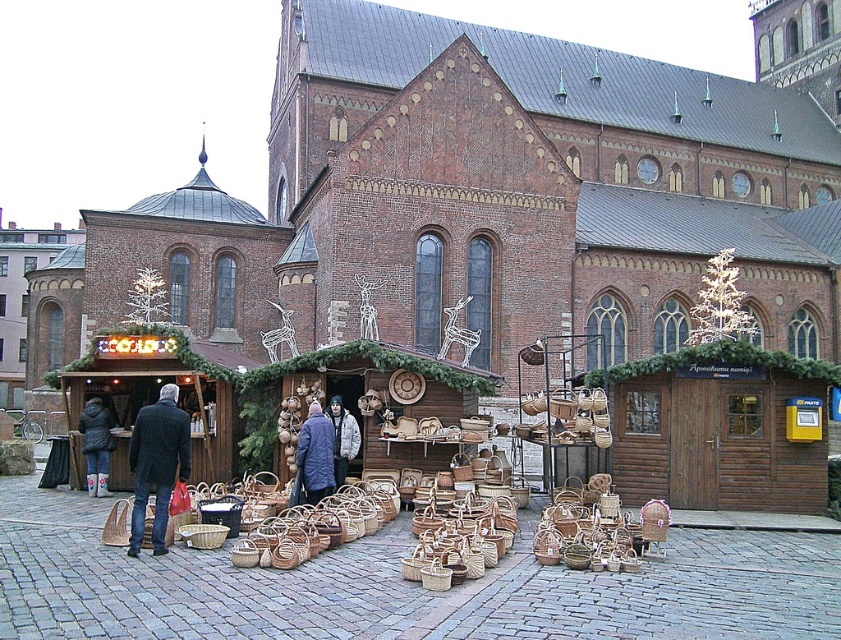
Question: Which point is closer to the camera?

Choices:
 (A) dark blue coat at center
 (B) white rubber boots at lower left
 (C) white puffy jacket at center

Answer: (A)

Question: Does white rubber boots at lower left appear on the right side of white puffy jacket at center?

Choices:
 (A) no
 (B) yes

Answer: (A)

Question: Is blue quilted coat at center to the left of white rubber boots at lower left from the viewer's perspective?

Choices:
 (A) yes
 (B) no

Answer: (B)

Question: Based on their relative distances, which object is nearer to the white rubber boots at lower left?

Choices:
 (A) dark blue coat at center
 (B) blue quilted coat at center
 (C) white puffy jacket at center

Answer: (C)

Question: Which object appears closest to the camera in this image?

Choices:
 (A) dark blue coat at center
 (B) white rubber boots at lower left
 (C) white puffy jacket at center

Answer: (A)

Question: Is dark blue coat at center wider than blue quilted coat at center?

Choices:
 (A) no
 (B) yes

Answer: (A)